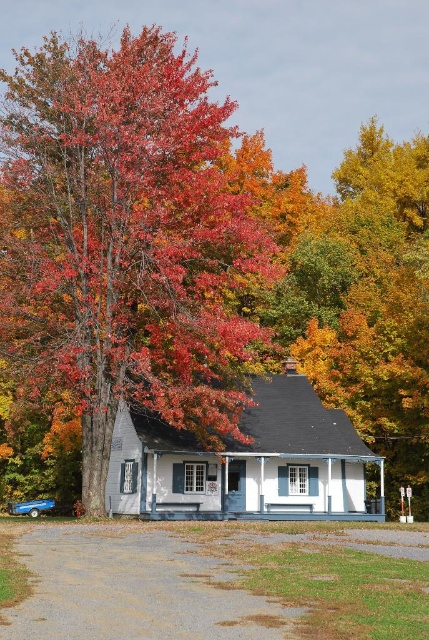
Question: Which point appears farthest from the camera in this image?

Choices:
 (A) (195, 64)
 (B) (375, 596)

Answer: (A)

Question: Which point appears closest to the camera in this image?

Choices:
 (A) click(x=3, y=253)
 (B) click(x=402, y=532)

Answer: (B)

Question: Is shiny red leaves at left above gray gravel driveway at lower center?

Choices:
 (A) no
 (B) yes

Answer: (B)

Question: Can you confirm if shiny red leaves at left is wider than gray gravel driveway at lower center?

Choices:
 (A) no
 (B) yes

Answer: (B)

Question: Which object appears closest to the camera in this image?

Choices:
 (A) gray gravel driveway at lower center
 (B) shiny red leaves at left

Answer: (A)

Question: Is shiny red leaves at left bigger than gray gravel driveway at lower center?

Choices:
 (A) no
 (B) yes

Answer: (B)